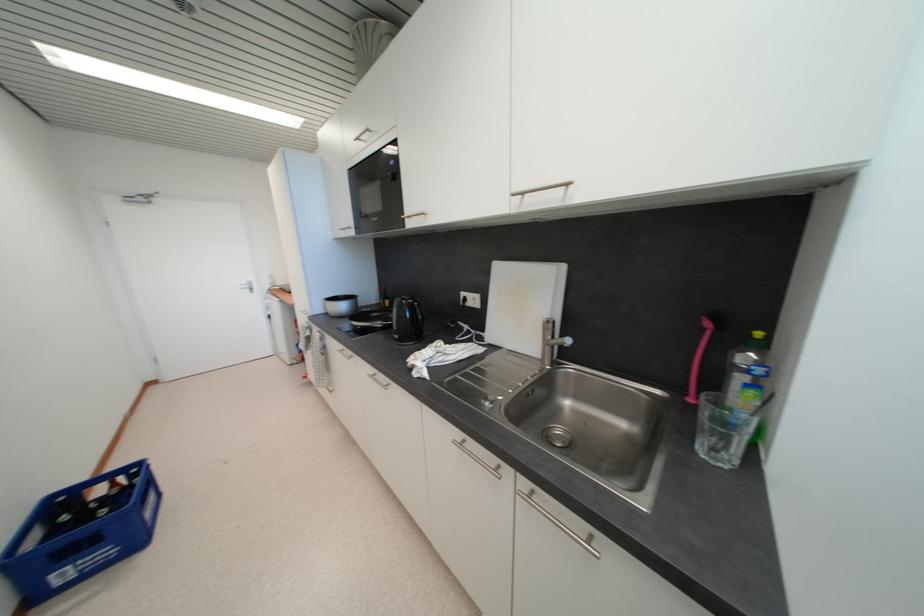
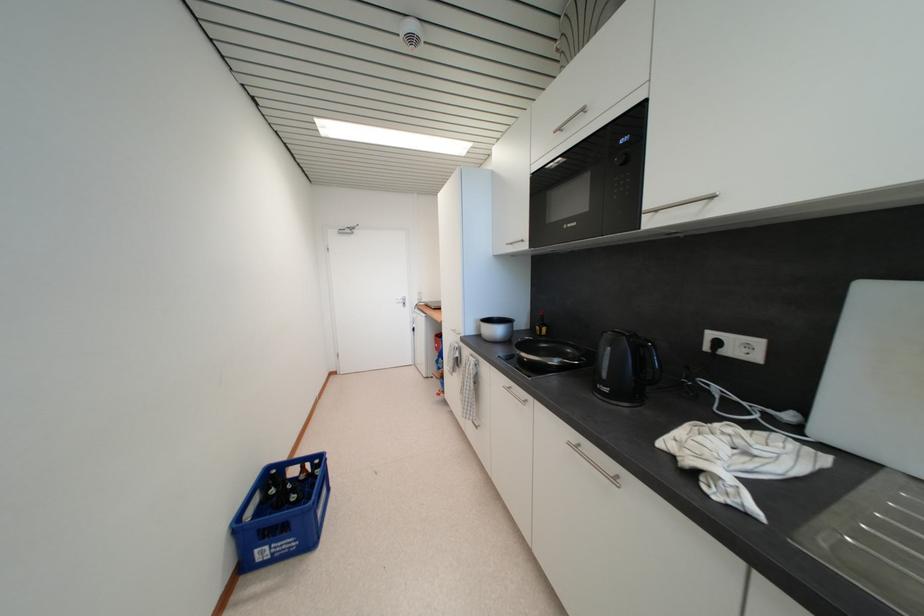
Question: The first image is from the beginning of the video and the second image is from the end. How did the camera likely rotate when shooting the video?

Choices:
 (A) Left
 (B) Right
 (C) Up
 (D) Down

Answer: (A)